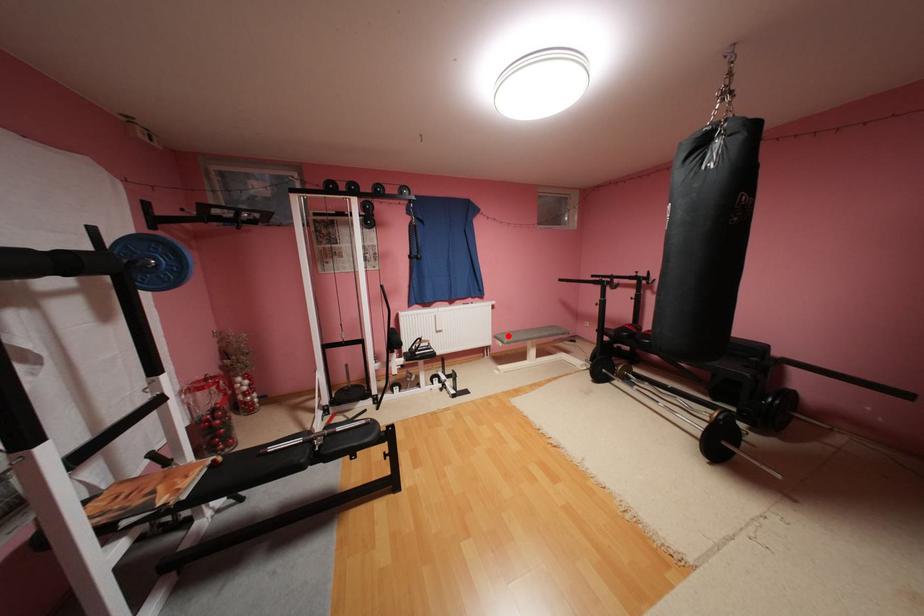
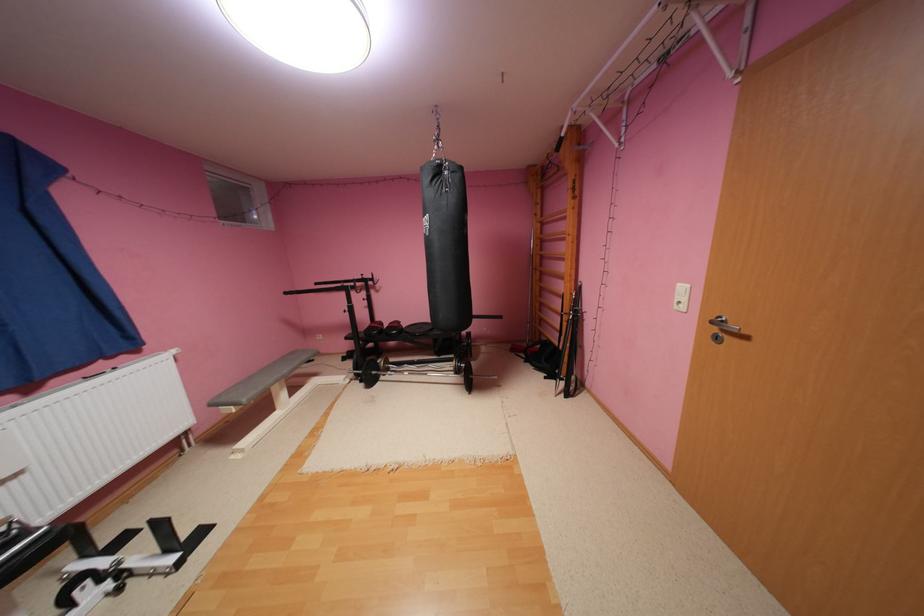
The point at the highlighted location is marked in the first image. Where is the corresponding point in the second image?

(233, 399)